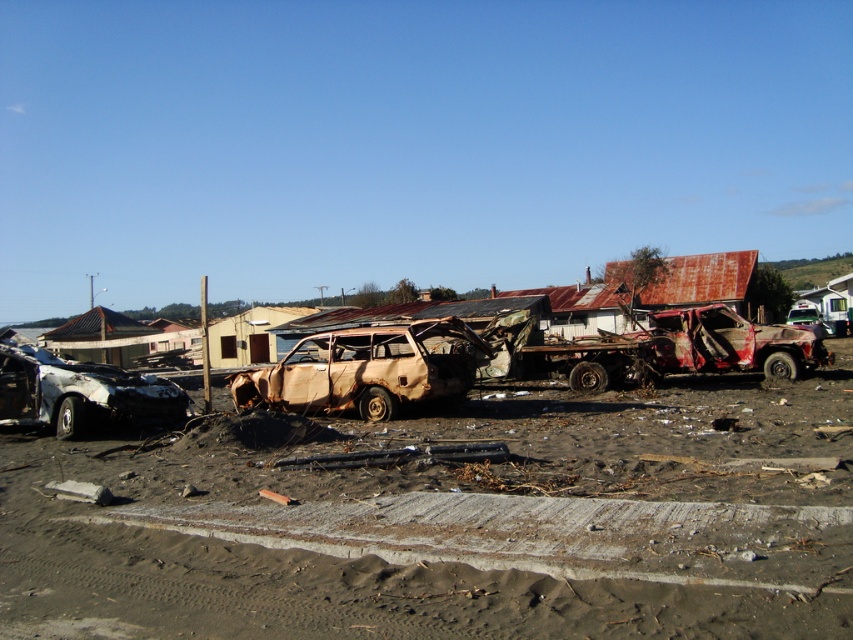
You are standing in the scene and want to take a photo of the burnt wood car at center. If your camera can focus on objects up to 15 meters away, will you be able to capture a clear image?

The burnt wood car at center is 13.57 meters from viewer, so yes, the camera can focus on it since it is within the 15 meters range.

You are a construction worker who needs to move the burnt wood car at center and the burnt wood car at lower left. Given that your crane has a maximum reach of 6 meters, can you lift both cars without moving the crane? Please explain your reasoning.

The burnt wood car at center is 6.39 meters away from the burnt wood car at lower left. Since the distance between them exceeds the crane s 6 meter reach, the crane cannot reach both cars simultaneously without moving its position.